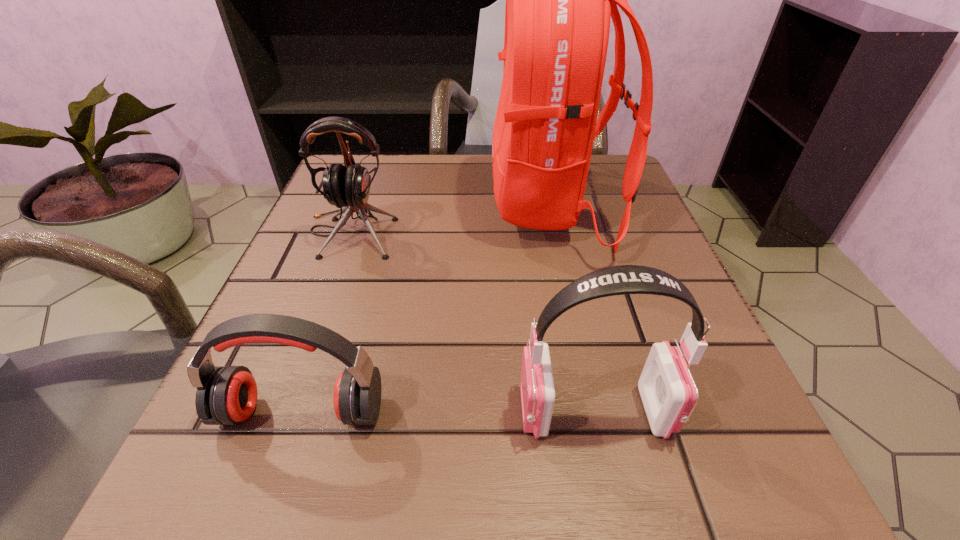
At what (x,y) coordinates should I click in order to perform the action: click on the tallest object. Please return your answer as a coordinate pair (x, y). This screenshot has height=540, width=960. Looking at the image, I should click on (559, 0).

Find the location of a particular element. The height and width of the screenshot is (540, 960). the farthest earphone is located at coordinates (348, 186).

Where is `the rightmost earphone`? Image resolution: width=960 pixels, height=540 pixels. the rightmost earphone is located at coordinates (669, 394).

This screenshot has width=960, height=540. Identify the location of the shortest object. (227, 395).

Image resolution: width=960 pixels, height=540 pixels. What are the coordinates of `free space located 0.310m on the main compartment of the tallest object` in the screenshot? It's located at (340, 207).

At what (x,y) coordinates should I click in order to perform the action: click on free region located 0.300m on the main compartment of the tallest object. Please return your answer as a coordinate pair (x, y). The height and width of the screenshot is (540, 960). Looking at the image, I should click on (345, 207).

This screenshot has height=540, width=960. Identify the location of free location located on the main compartment of the tallest object. (370, 207).

Identify the location of vacant space situated 0.090m on the back of the farthest earphone. (368, 186).

Identify the location of vacant area located 0.240m on the outer surface of the rightmost earphone. Image resolution: width=960 pixels, height=540 pixels. (331, 411).

I want to click on vacant space located on the outer surface of the rightmost earphone, so click(x=276, y=411).